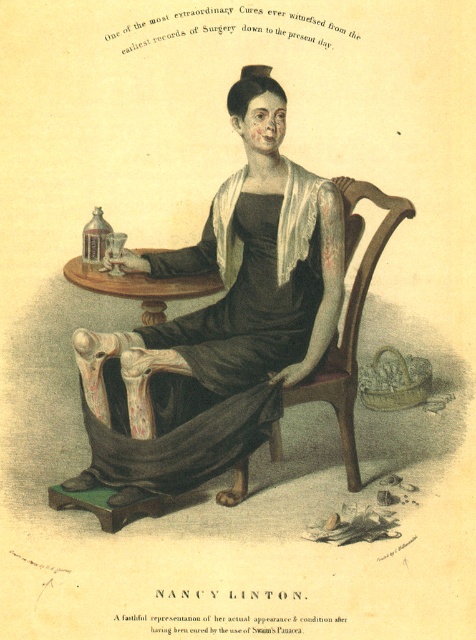
Between matte black dress at center and wooden polished table at center left, which one has more height?

matte black dress at center is taller.

Does matte black dress at center have a larger size compared to wooden polished table at center left?

Yes, matte black dress at center is bigger than wooden polished table at center left.

Who is more distant from viewer, (238, 284) or (130, 284)?

The point (238, 284) is more distant.

At what (x,y) coordinates should I click in order to perform the action: click on matte black dress at center. Please return your answer as a coordinate pair (x, y). Looking at the image, I should click on (214, 369).